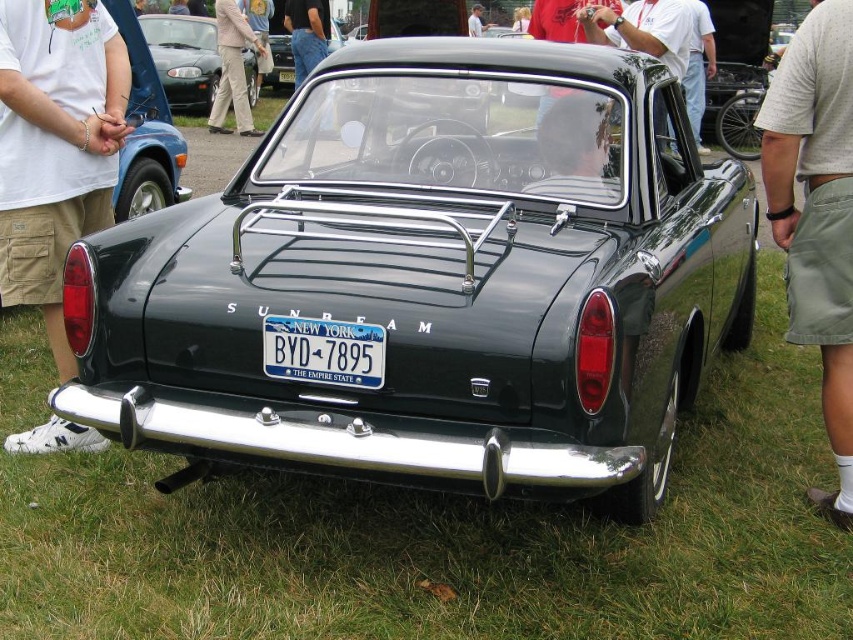
Between shiny dark green car at center and blue jeans at center, which one appears on the right side from the viewer's perspective?

Positioned to the right is shiny dark green car at center.

Find the location of a particular element. The image size is (853, 640). shiny dark green car at center is located at coordinates (434, 278).

Who is shorter, blue metallic license plate at center or blue jeans at center?

Standing shorter between the two is blue metallic license plate at center.

Is point (277, 369) positioned after point (326, 38)?

No, (277, 369) is in front of (326, 38).

Between point (335, 360) and point (317, 54), which one is positioned behind?

The point (317, 54) is more distant.

Find the location of `blue metallic license plate at center`. blue metallic license plate at center is located at coordinates (323, 352).

Is blue jeans at center above green metallic car at center?

Actually, blue jeans at center is below green metallic car at center.

Which is more to the left, blue jeans at center or green metallic car at center?

green metallic car at center is more to the left.

Who is more distant from viewer, (299, 26) or (276, 72)?

The point (276, 72) is behind.

Find the location of a particular element. blue jeans at center is located at coordinates (306, 35).